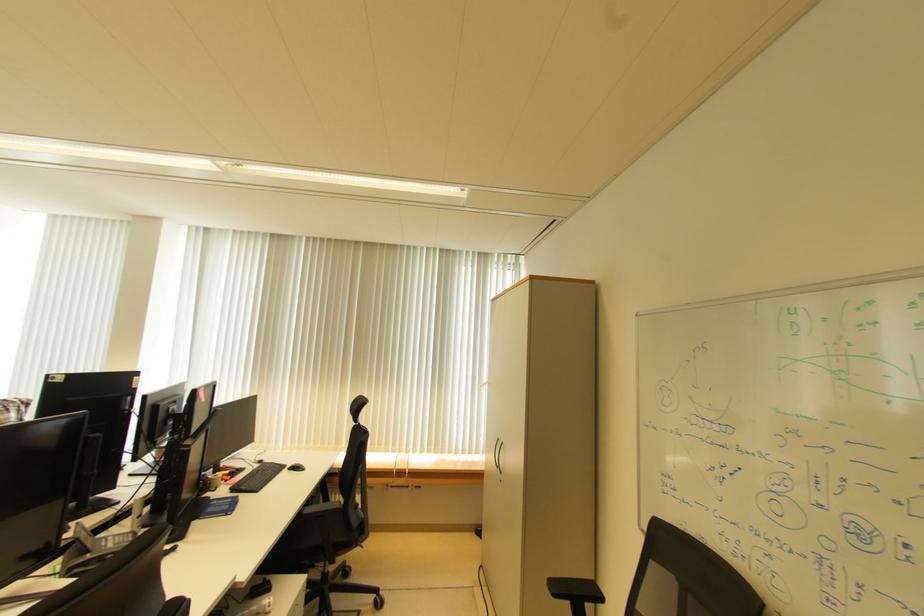
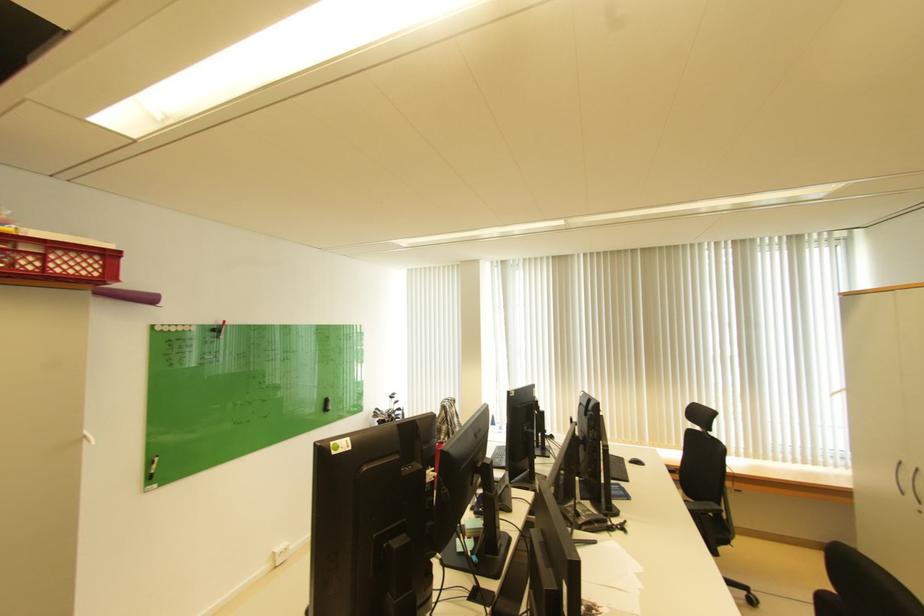
What movement of the cameraman would produce the second image?

The cameraman moved toward left, backward.